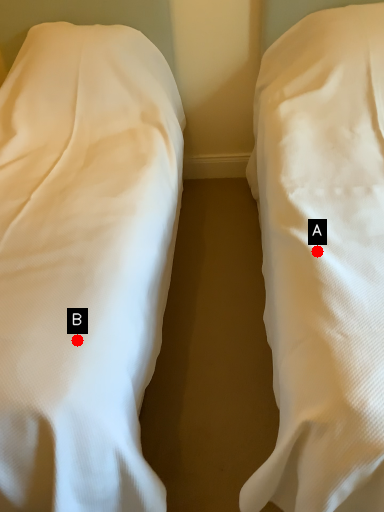
Question: Two points are circled on the image, labeled by A and B beside each circle. Which point is closer to the camera?

Choices:
 (A) A is closer
 (B) B is closer

Answer: (B)